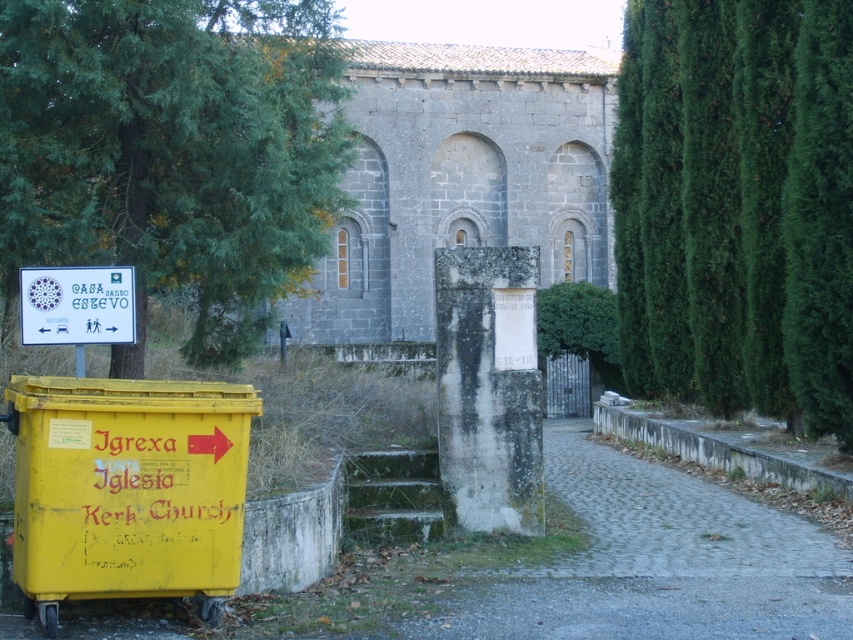
You are a tourist standing at the entrance of the historical building and want to take a photo with both the green leafy tree at upper left and the white paper sign at upper left in the frame. Based on their sizes, do you think you can fit both into the photo without zooming in?

The green leafy tree at upper left is much taller than the white paper sign at upper left, so you might need to adjust your position to ensure both fit in the frame, but it should be possible without zooming in.

You are a tourist holding a map that says the church is to the right of the tree. According to the image, is the gray stone church at center actually located to the right of the green leafy tree at right?

The green leafy tree at right has a smaller size compared to gray stone church at center, but the question is about their positions. Since the tree is at the right side of the image and the church is at the center, the gray stone church at center is to the left of the green leafy tree at right, not the right as the map suggests.

You are a tourist standing at the pathway leading to the historical building. You see the green leafy tree at right and the white stone pillar at center. Which object is closer to you?

The green leafy tree at right is closer to you because the white stone pillar at center is behind it.